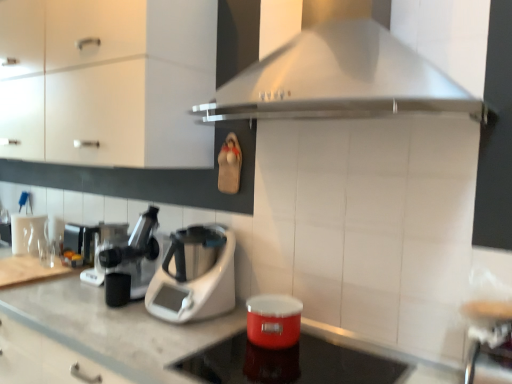
Locate an element on the screen. The width and height of the screenshot is (512, 384). vacant space in front of white plastic coffee machine at center, acting as the 3th coffee machine starting from the back is located at coordinates (111, 315).